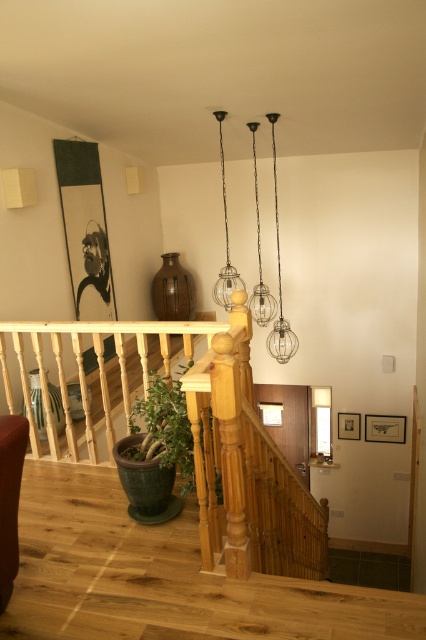
In the scene shown: Does natural wood stair rail at center have a lesser height compared to green matte plant at lower left?

In fact, natural wood stair rail at center may be taller than green matte plant at lower left.

The height and width of the screenshot is (640, 426). What are the coordinates of `natural wood stair rail at center` in the screenshot? It's located at (186, 429).

Where is `natural wood stair rail at center`? natural wood stair rail at center is located at coordinates (186, 429).